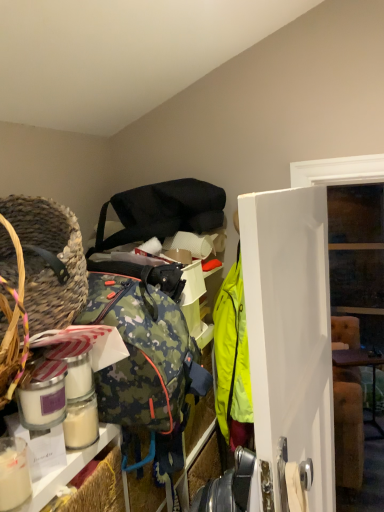
Question: Is matte black shoulder bag at upper center bigger than braided straw basket at left?

Choices:
 (A) no
 (B) yes

Answer: (B)

Question: Could you tell me if matte black shoulder bag at upper center is facing braided straw basket at left?

Choices:
 (A) no
 (B) yes

Answer: (A)

Question: Is matte black shoulder bag at upper center turned away from braided straw basket at left?

Choices:
 (A) yes
 (B) no

Answer: (B)

Question: Considering the relative positions of matte black shoulder bag at upper center and braided straw basket at left in the image provided, is matte black shoulder bag at upper center to the left of braided straw basket at left from the viewer's perspective?

Choices:
 (A) no
 (B) yes

Answer: (A)

Question: Considering the relative sizes of matte black shoulder bag at upper center and braided straw basket at left in the image provided, is matte black shoulder bag at upper center shorter than braided straw basket at left?

Choices:
 (A) yes
 (B) no

Answer: (A)

Question: From a real-world perspective, does matte black shoulder bag at upper center sit lower than braided straw basket at left?

Choices:
 (A) no
 (B) yes

Answer: (A)

Question: Is white glossy door at center to the right of matte black shoulder bag at upper center from the viewer's perspective?

Choices:
 (A) yes
 (B) no

Answer: (A)

Question: Is white glossy door at center wider than matte black shoulder bag at upper center?

Choices:
 (A) no
 (B) yes

Answer: (A)

Question: Is white glossy door at center turned away from matte black shoulder bag at upper center?

Choices:
 (A) yes
 (B) no

Answer: (A)

Question: Does white glossy door at center appear on the left side of matte black shoulder bag at upper center?

Choices:
 (A) no
 (B) yes

Answer: (A)

Question: Could you tell me if white glossy door at center is facing matte black shoulder bag at upper center?

Choices:
 (A) yes
 (B) no

Answer: (B)

Question: Does white glossy door at center come in front of matte black shoulder bag at upper center?

Choices:
 (A) no
 (B) yes

Answer: (B)

Question: Does brown wooden table at right lie behind braided straw basket at left?

Choices:
 (A) no
 (B) yes

Answer: (B)